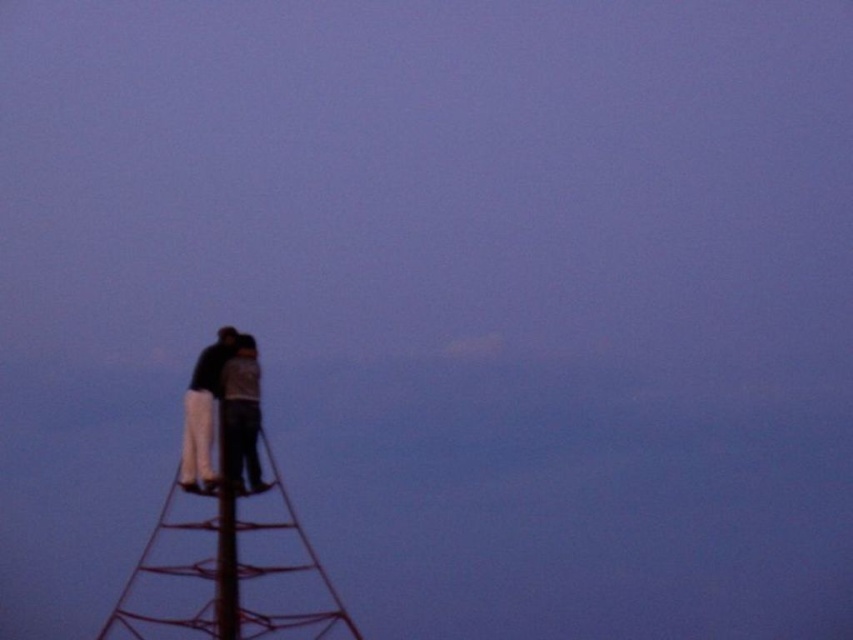
Question: Is metallic red ladder at upper left below dark gray fabric couple at upper left?

Choices:
 (A) yes
 (B) no

Answer: (A)

Question: Which object is farther from the camera taking this photo?

Choices:
 (A) metallic red ladder at upper left
 (B) metallic red ladder at left
 (C) dark gray fabric couple at upper left

Answer: (B)

Question: Which of these objects is positioned closest to the dark gray fabric couple at upper left?

Choices:
 (A) metallic red ladder at upper left
 (B) metallic red ladder at left

Answer: (B)

Question: Can you confirm if metallic red ladder at upper left is bigger than dark gray fabric couple at upper left?

Choices:
 (A) yes
 (B) no

Answer: (A)

Question: Is metallic red ladder at upper left bigger than metallic red ladder at left?

Choices:
 (A) no
 (B) yes

Answer: (B)

Question: Which point appears farthest from the camera in this image?

Choices:
 (A) (175, 561)
 (B) (231, 474)

Answer: (B)